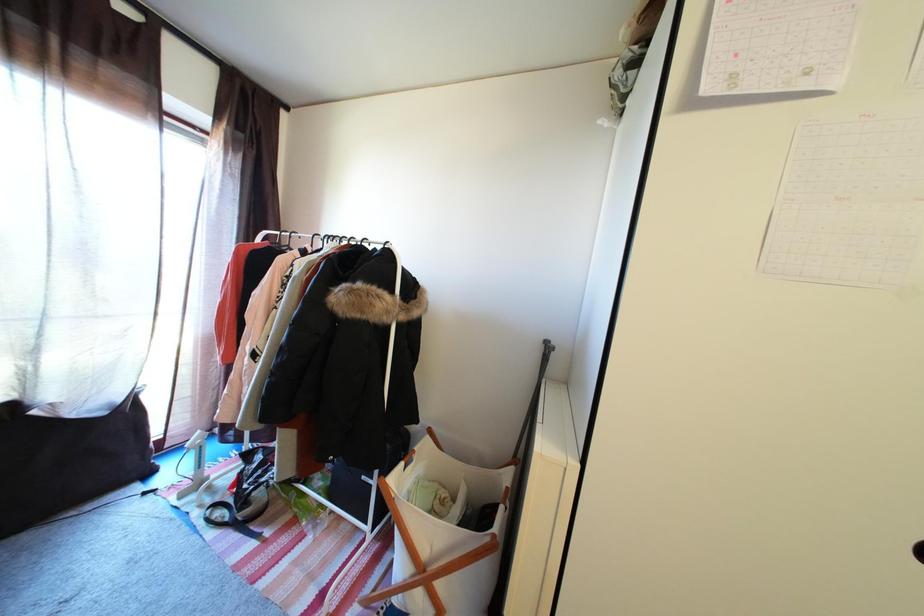
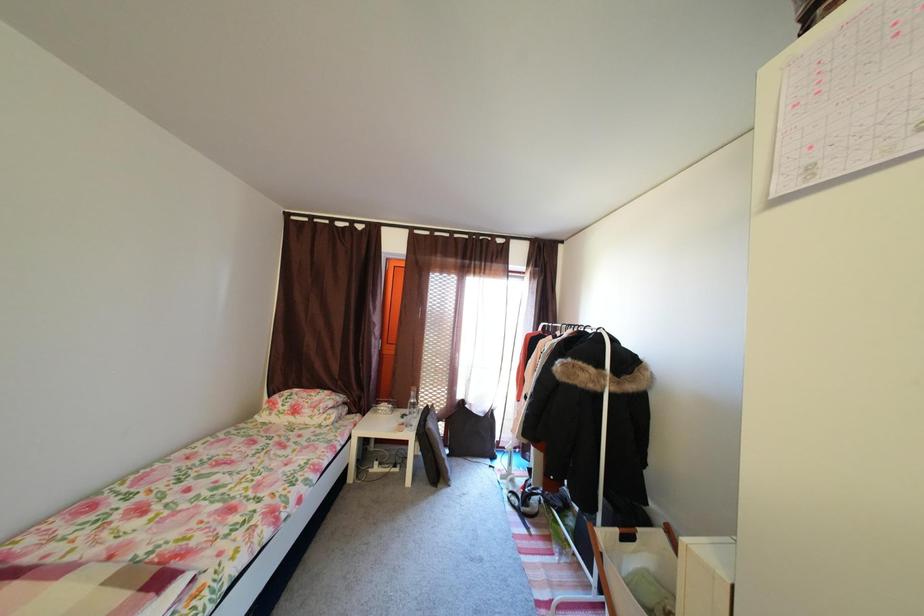
Question: The camera is either moving clockwise (left) or counter-clockwise (right) around the object. The first image is from the beginning of the video and the second image is from the end. Is the camera moving left or right when shooting the video?

Choices:
 (A) Left
 (B) Right

Answer: (B)